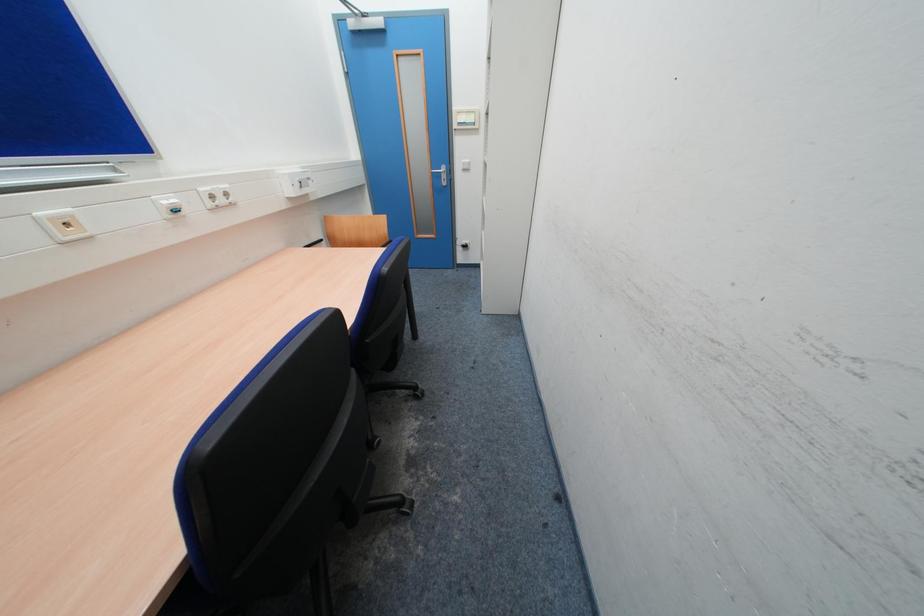
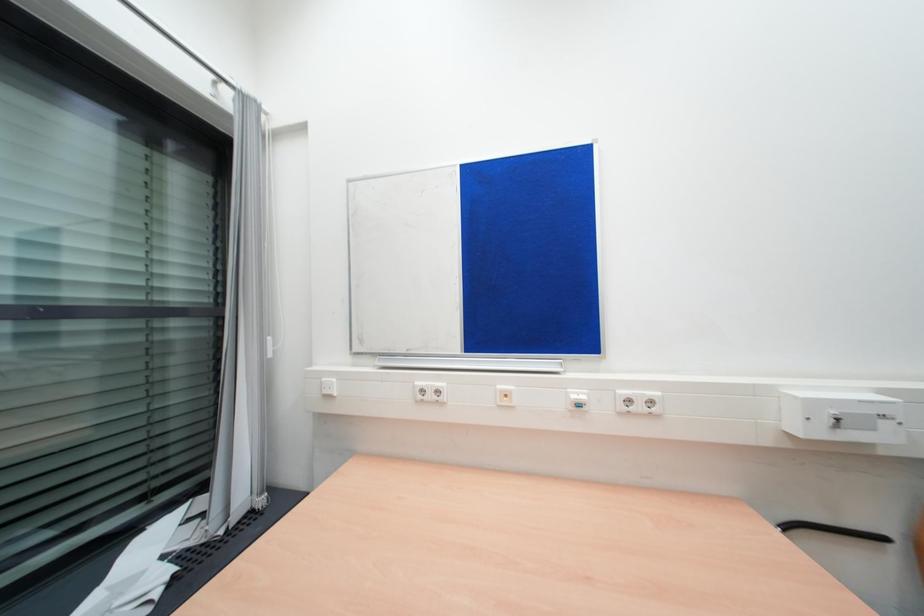
Question: The camera is either moving clockwise (left) or counter-clockwise (right) around the object. The first image is from the beginning of the video and the second image is from the end. Is the camera moving left or right when shooting the video?

Choices:
 (A) Left
 (B) Right

Answer: (B)